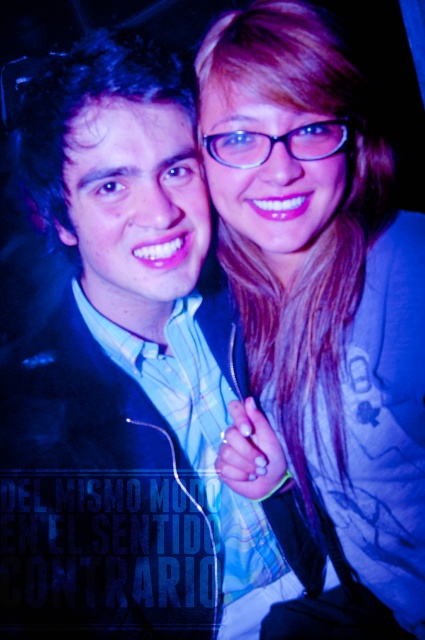
You are a photographer adjusting the lighting for a photo shoot. You notice the matte black suit at center and the matte blue jacket at upper right in the frame. Which object is located to the left of the other?

The matte black suit at center is positioned on the left side of matte blue jacket at upper right.

You are a photographer adjusting the lighting for a photo shoot. You notice the matte black suit at center and the matte blue jacket at upper right. Which object should you focus on first if you want to highlight the taller one?

The matte blue jacket at upper right is taller than the matte black suit at center, so you should focus on the matte blue jacket at upper right first to highlight the taller one.

You are a photographer adjusting the lighting for a photo shoot. You notice the matte black suit at center and the matte blue jacket at upper right. Which object is closer to the camera, based on their positions in the image?

The matte black suit at center is closer to the camera because the matte blue jacket at upper right is behind it.